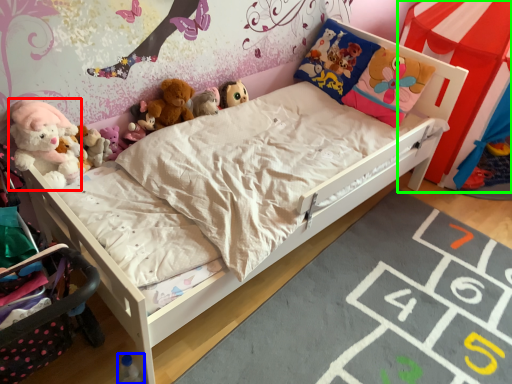
Question: Which object is the closest to the toy (highlighted by a red box)? Choose among these: toy (highlighted by a blue box) or canopy bed (highlighted by a green box).

Choices:
 (A) toy
 (B) canopy bed

Answer: (A)